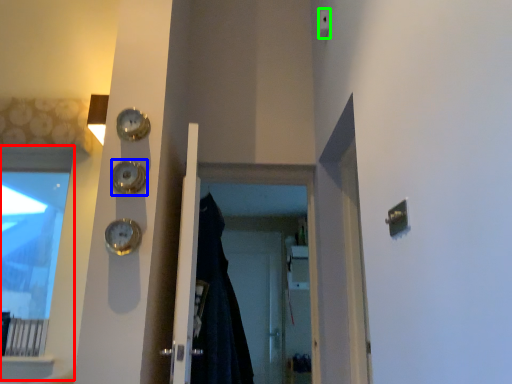
Question: Which object is positioned farthest from window (highlighted by a red box)? Select from clock (highlighted by a blue box) and light switch (highlighted by a green box).

Choices:
 (A) clock
 (B) light switch

Answer: (B)